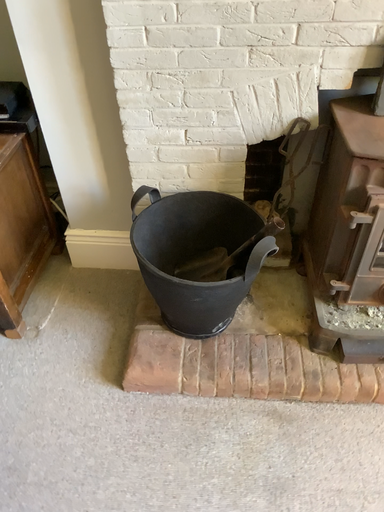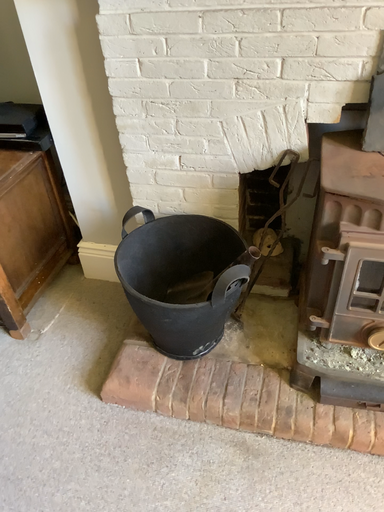
Question: Which way did the camera rotate in the video?

Choices:
 (A) rotated right
 (B) rotated left

Answer: (B)